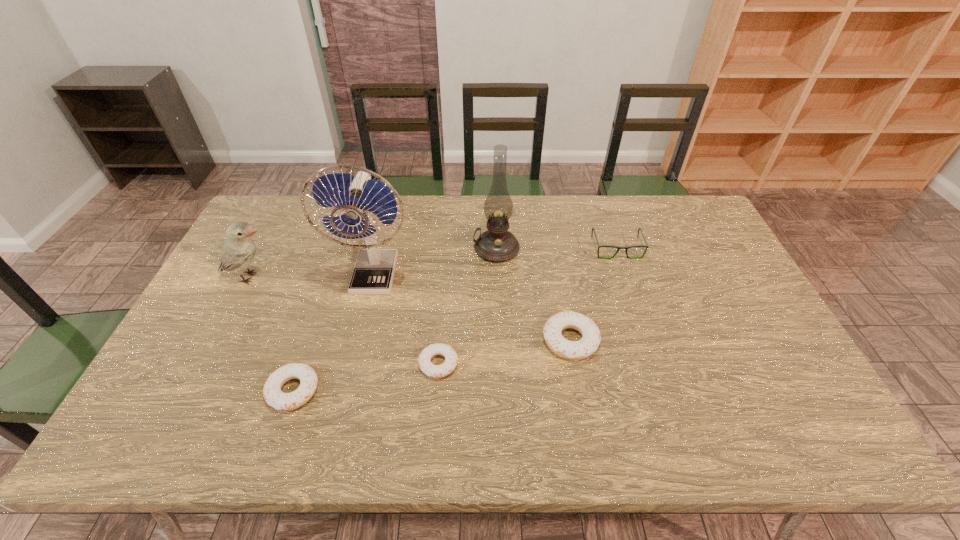
You are a GUI agent. You are given a task and a screenshot of the screen. Output one action in this format:
    pyautogui.click(x=<x>, y=<y>)
    Task: Click on the vacant region at the far edge of the desktop
    
    Given the screenshot: What is the action you would take?
    pyautogui.click(x=643, y=222)

Image resolution: width=960 pixels, height=540 pixels. Find the location of `vacant point at the near edge`. vacant point at the near edge is located at coordinates (605, 381).

The height and width of the screenshot is (540, 960). In the image, there is a desktop. Find the location of `vacant space at the left edge`. vacant space at the left edge is located at coordinates (218, 328).

Where is `free space at the right edge`? The image size is (960, 540). free space at the right edge is located at coordinates (791, 364).

Locate an element on the screen. Image resolution: width=960 pixels, height=540 pixels. free point at the far left corner is located at coordinates (296, 230).

You are a GUI agent. You are given a task and a screenshot of the screen. Output one action in this format:
    pyautogui.click(x=<x>, y=<y>)
    Task: Click on the free region at the far right corner of the desktop
    Image resolution: width=960 pixels, height=540 pixels.
    Given the screenshot: What is the action you would take?
    pyautogui.click(x=678, y=224)

Where is `vacant space at the near right corner of the desktop`? This screenshot has height=540, width=960. vacant space at the near right corner of the desktop is located at coordinates (742, 392).

The width and height of the screenshot is (960, 540). In order to click on vacant point located between the leftmost doughnut and the rightmost object in this screenshot , I will do `click(455, 319)`.

I want to click on empty location between the rightmost doughnut and the shortest object, so click(504, 352).

Locate an element on the screen. The height and width of the screenshot is (540, 960). empty space that is in between the sixth object from left to right and the fan is located at coordinates (472, 308).